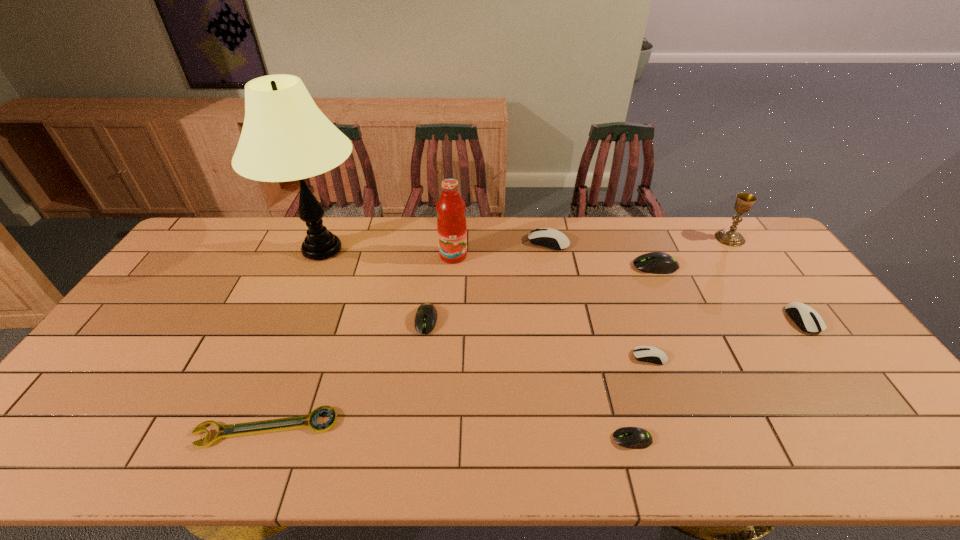
What are the coordinates of `free space located on the wheel side of the second shortest object` in the screenshot? It's located at (530, 439).

This screenshot has width=960, height=540. In order to click on free space located 0.380m on the right of the wrench in this screenshot , I will do `click(497, 428)`.

Where is `lamp at the far edge`? This screenshot has height=540, width=960. lamp at the far edge is located at coordinates (285, 137).

I want to click on fruit juice that is at the far edge, so click(x=451, y=223).

The width and height of the screenshot is (960, 540). What are the coordinates of `chalice that is positioned at the far edge` in the screenshot? It's located at (744, 201).

Locate an element on the screen. Image resolution: width=960 pixels, height=540 pixels. mouse situated at the far edge is located at coordinates (550, 238).

Locate an element on the screen. The image size is (960, 540). computer mouse that is positioned at the near edge is located at coordinates (629, 437).

Where is `wrench that is at the near edge`? The height and width of the screenshot is (540, 960). wrench that is at the near edge is located at coordinates (325, 427).

Find the location of a particular element. chalice present at the right edge is located at coordinates (744, 201).

The width and height of the screenshot is (960, 540). Identify the location of mouse present at the right edge. (806, 318).